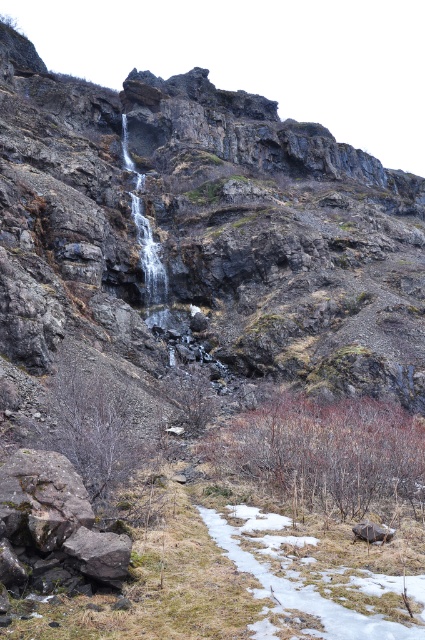
Question: Does rusty metallic rock at lower left appear under smooth gray rock at lower right?

Choices:
 (A) yes
 (B) no

Answer: (B)

Question: Which point is farther from the camera taking this photo?

Choices:
 (A) (28, 518)
 (B) (391, 538)

Answer: (B)

Question: Is rusty metallic rock at lower left smaller than smooth gray rock at lower right?

Choices:
 (A) yes
 (B) no

Answer: (B)

Question: Among these objects, which one is farthest from the camera?

Choices:
 (A) smooth gray rock at lower right
 (B) rusty metallic rock at lower left

Answer: (A)

Question: From the image, what is the correct spatial relationship of rusty metallic rock at lower left in relation to smooth gray rock at lower right?

Choices:
 (A) above
 (B) below

Answer: (A)

Question: Which object appears farthest from the camera in this image?

Choices:
 (A) smooth gray rock at lower right
 (B) rusty metallic rock at lower left

Answer: (A)